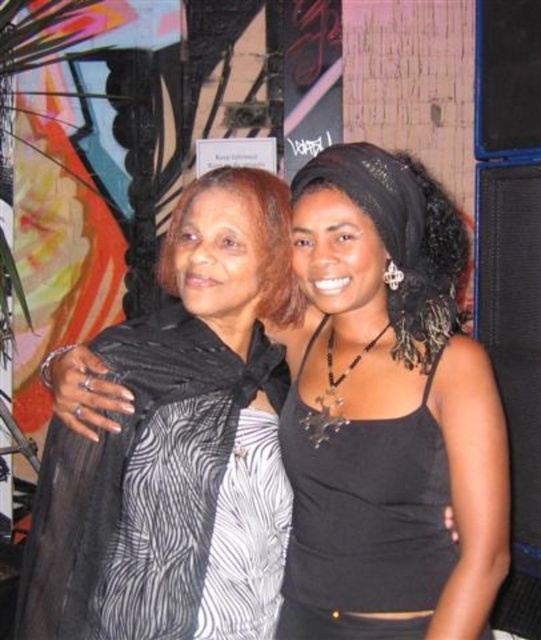
Question: Which of the following is the closest to the observer?

Choices:
 (A) matte black scarf at center
 (B) black matte tank top at center

Answer: (B)

Question: Which point is closer to the camera?

Choices:
 (A) (261, 204)
 (B) (399, 433)

Answer: (B)

Question: Considering the relative positions of black matte tank top at center and matte black scarf at center in the image provided, where is black matte tank top at center located with respect to matte black scarf at center?

Choices:
 (A) below
 (B) above

Answer: (A)

Question: Does black matte tank top at center appear over matte black scarf at center?

Choices:
 (A) no
 (B) yes

Answer: (A)

Question: Which of the following is the farthest from the observer?

Choices:
 (A) (283, 323)
 (B) (431, 291)

Answer: (A)

Question: Can you confirm if black matte tank top at center is thinner than matte black scarf at center?

Choices:
 (A) yes
 (B) no

Answer: (B)